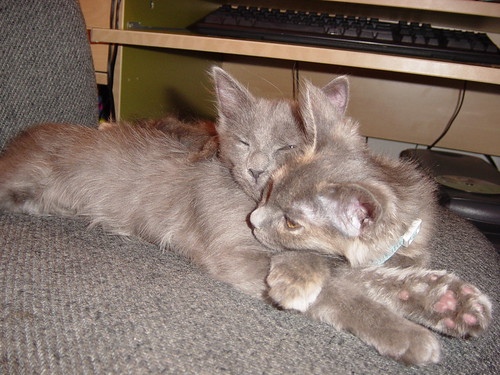
In order to click on keyboard in this screenshot , I will do `click(412, 33)`.